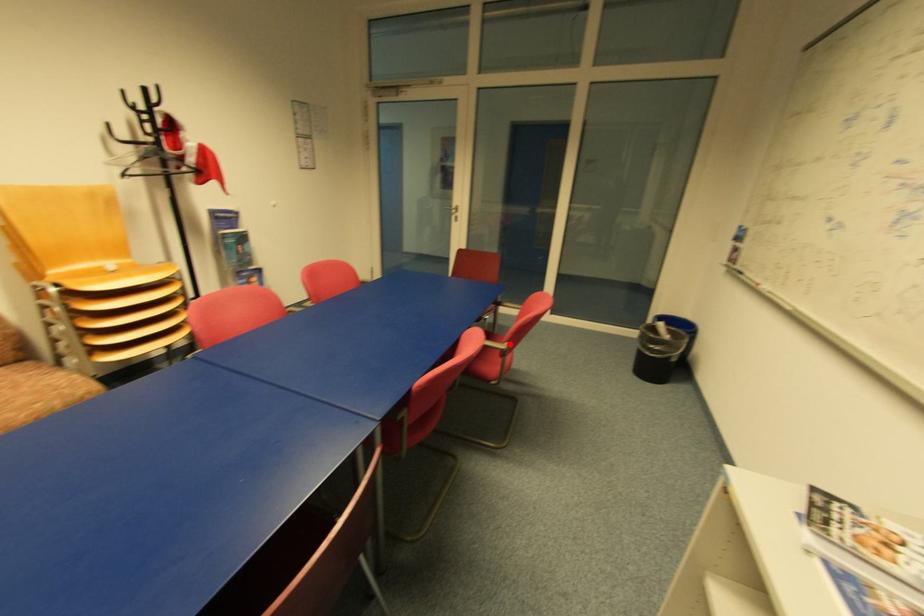
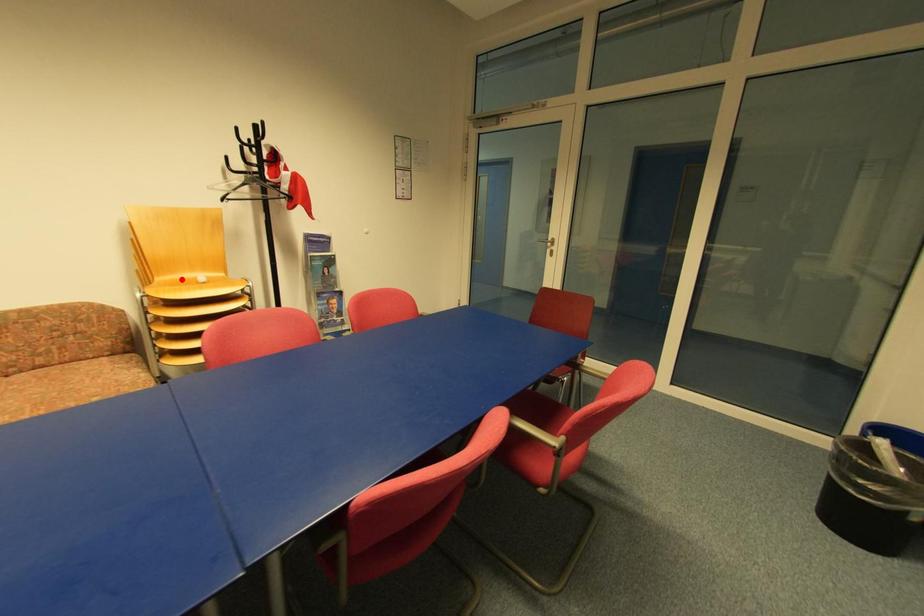
I am providing you with two images of the same scene from different viewpoints. A red point is marked on the first image and another point is marked on the second image. Does the point marked in image1 correspond to the same location as the one in image2?

No